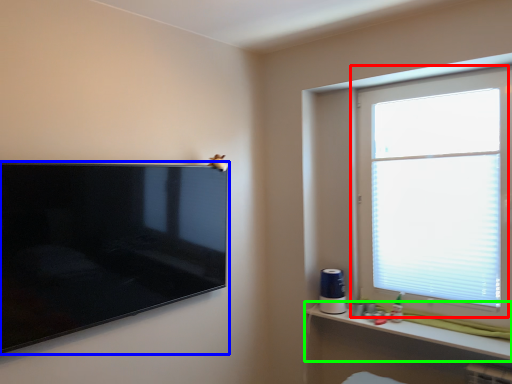
Question: Based on their relative distances, which object is farther from window (highlighted by a red box)? Choose from television (highlighted by a blue box) and shelf (highlighted by a green box).

Choices:
 (A) television
 (B) shelf

Answer: (A)